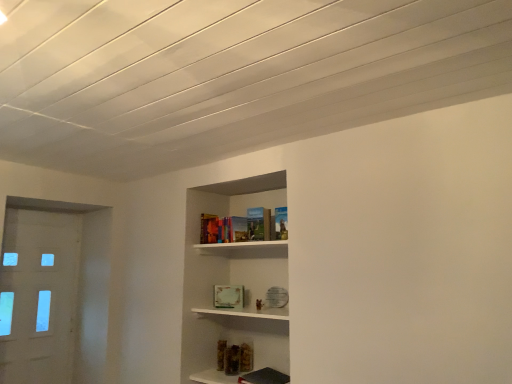
Question: Visually, is white glossy door at left positioned to the left or to the right of matte hardcover book at center?

Choices:
 (A) right
 (B) left

Answer: (B)

Question: Does point (32, 339) appear closer or farther from the camera than point (248, 233)?

Choices:
 (A) closer
 (B) farther

Answer: (B)

Question: Is white glossy door at left bigger or smaller than matte hardcover book at center?

Choices:
 (A) big
 (B) small

Answer: (A)

Question: Looking at their shapes, would you say matte hardcover book at center is wider or thinner than white glossy door at left?

Choices:
 (A) thin
 (B) wide

Answer: (B)

Question: Choose the correct answer: Is matte hardcover book at center inside white glossy door at left or outside it?

Choices:
 (A) outside
 (B) inside

Answer: (A)

Question: Would you say matte hardcover book at center is to the left or to the right of white glossy door at left in the picture?

Choices:
 (A) left
 (B) right

Answer: (B)

Question: Is matte hardcover book at center bigger or smaller than white glossy door at left?

Choices:
 (A) small
 (B) big

Answer: (A)